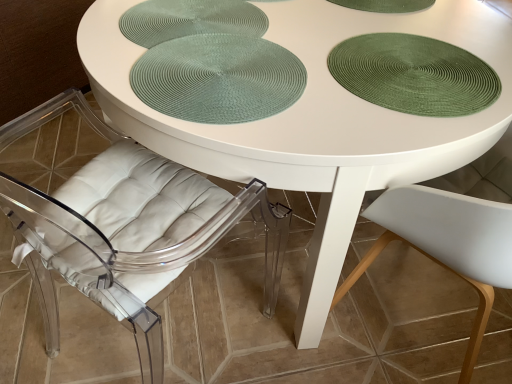
What are the coordinates of `vacant space behind green woven placemat at center` in the screenshot? It's located at (241, 22).